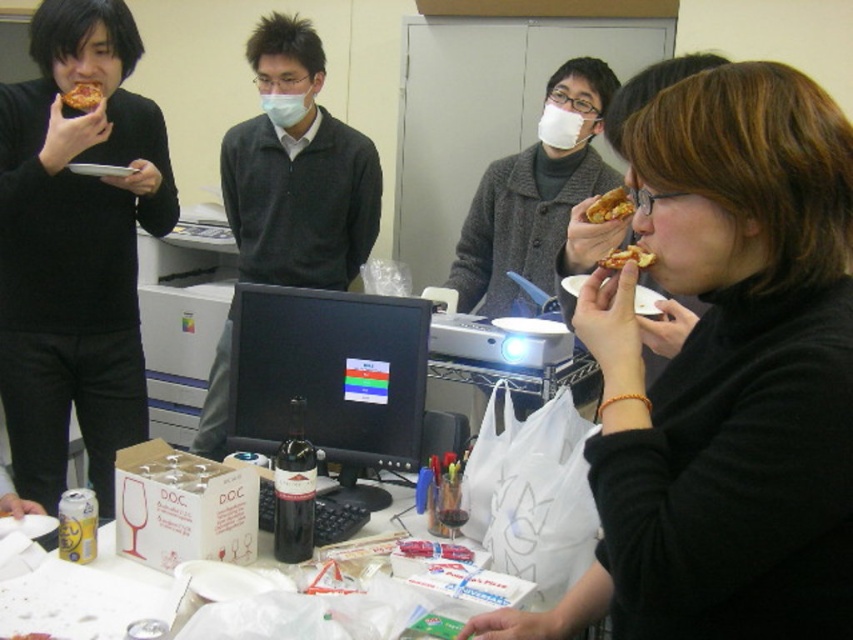
Does golden crispy pizza slice at upper left appear on the left side of slightly crispy golden-brown pizza slice at upper right?

Yes, golden crispy pizza slice at upper left is to the left of slightly crispy golden-brown pizza slice at upper right.

Which is in front, point (96, 83) or point (621, 268)?

Positioned in front is point (621, 268).

Identify the location of golden crispy pizza slice at upper left. The image size is (853, 640). (82, 97).

Is white matte mask at center smaller than golden crispy pizza slice at upper left?

No, white matte mask at center is not smaller than golden crispy pizza slice at upper left.

From the picture: Is white matte mask at center bigger than golden crispy pizza slice at upper left?

Correct, white matte mask at center is larger in size than golden crispy pizza slice at upper left.

Describe the element at coordinates (560, 125) in the screenshot. The height and width of the screenshot is (640, 853). I see `white matte mask at center` at that location.

You are a GUI agent. You are given a task and a screenshot of the screen. Output one action in this format:
    pyautogui.click(x=<x>, y=<y>)
    Task: Click on the white matte mask at center
    The height and width of the screenshot is (640, 853).
    Given the screenshot: What is the action you would take?
    pyautogui.click(x=560, y=125)

Between white matte coat at center and matte blue mask at center, which one appears on the left side from the viewer's perspective?

Positioned to the left is matte blue mask at center.

Is white matte coat at center closer to camera compared to matte blue mask at center?

Yes, it is in front of matte blue mask at center.

Which is behind, point (590, 125) or point (270, 109)?

Point (270, 109)

Where is `white matte coat at center`? This screenshot has width=853, height=640. white matte coat at center is located at coordinates (534, 195).